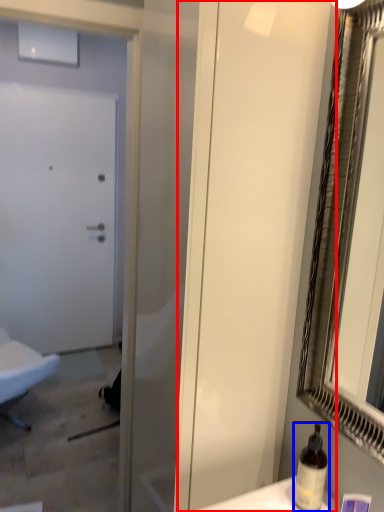
Question: Which object is closer to the camera taking this photo, screen door (highlighted by a red box) or bottle (highlighted by a blue box)?

Choices:
 (A) screen door
 (B) bottle

Answer: (A)